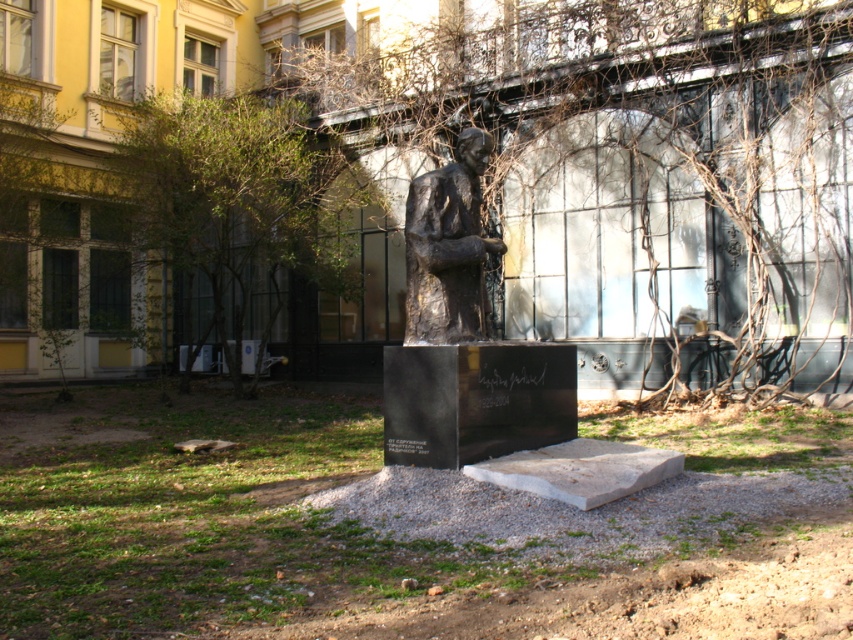
You are standing in the courtyard where the bronze statue is located. You see a point marked at coordinates (625,179). What object does this point correspond to?

The point at coordinates (625,179) corresponds to the brown leafless branches at center.

You are standing in the courtyard and notice the brown leafless branches at center and the green leafy tree at upper left. Which object is closer to you?

The brown leafless branches at center is closer to you because it is in front of the green leafy tree at upper left.

In the scene shown: You are standing in the courtyard and want to take a photo of the bronze statue at center without any obstructions. Is the green leafy tree at upper left too large to block the view?

The green leafy tree at upper left is smaller than the bronze statue at center, so it won not block the view of the bronze statue at center.